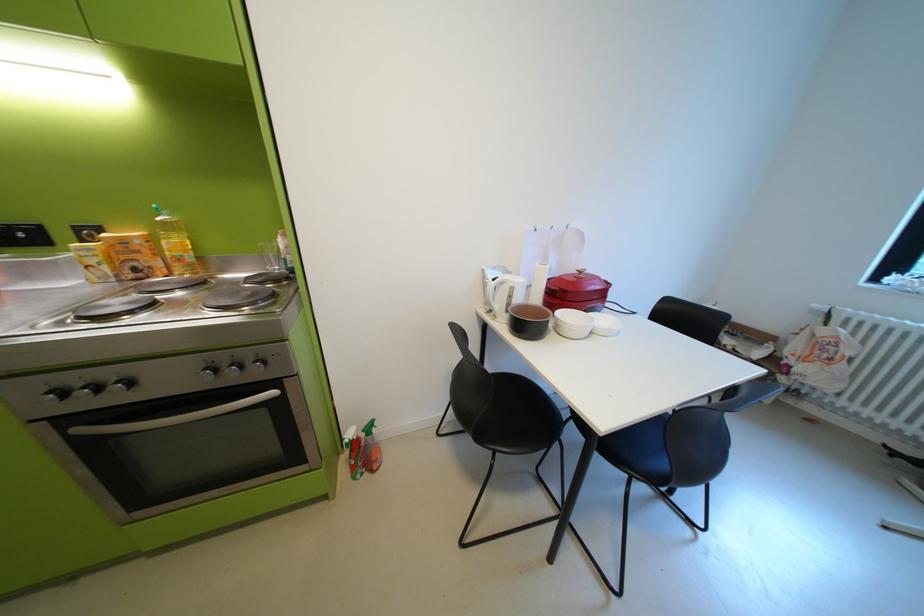
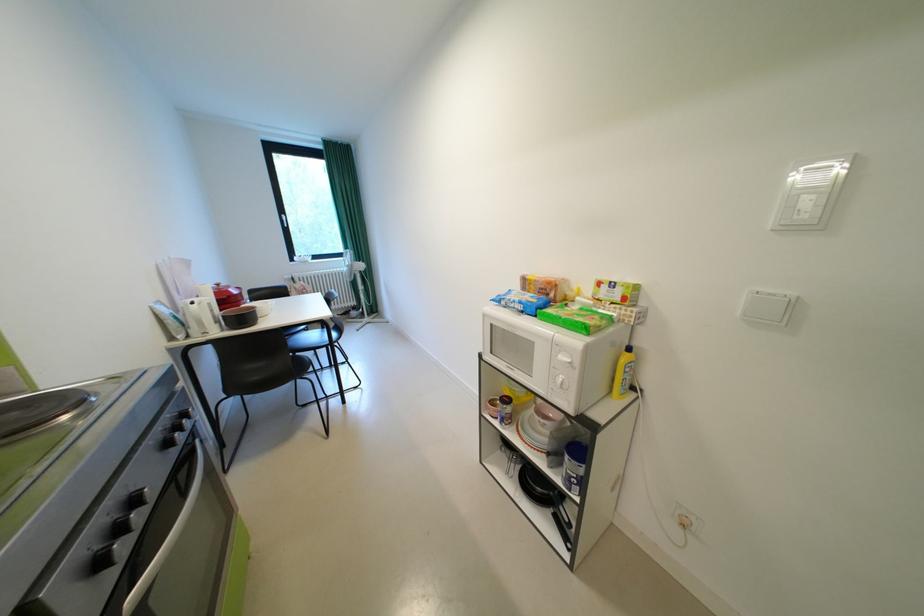
Find the pixel in the second image that matches pixel 504 281 in the first image.

(203, 304)